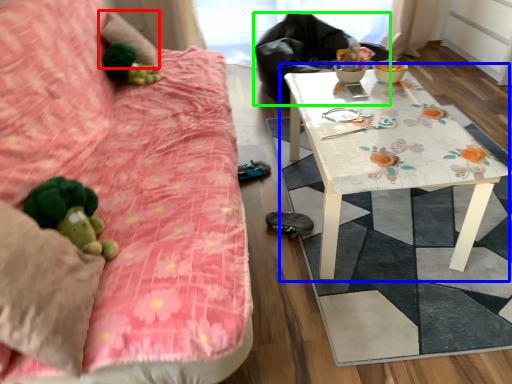
Question: Which object is the farthest from pillow (highlighted by a red box)? Choose among these: table (highlighted by a blue box) or sit (highlighted by a green box).

Choices:
 (A) table
 (B) sit

Answer: (A)